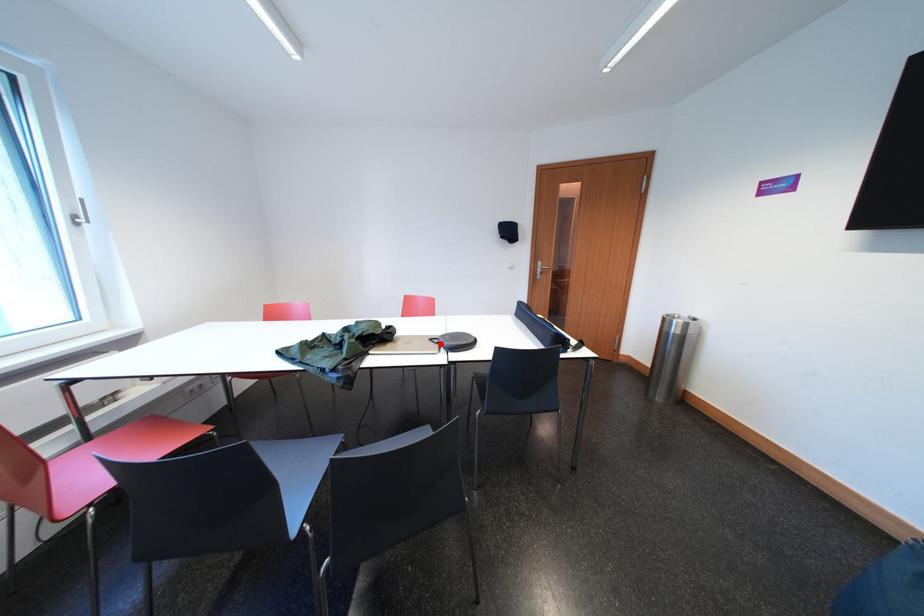
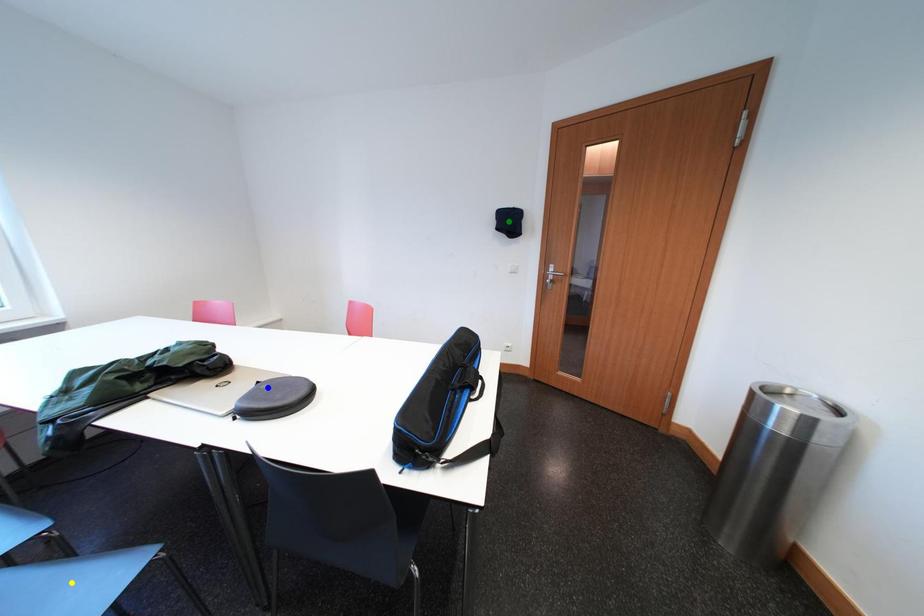
Question: I am providing you with two images of the same scene from different viewpoints. A red point is marked on the first image. You are given multiple points on the second image. Can you choose the point in image 2 that corresponds to the point in image 1?

Choices:
 (A) yellow point
 (B) green point
 (C) blue point

Answer: (C)